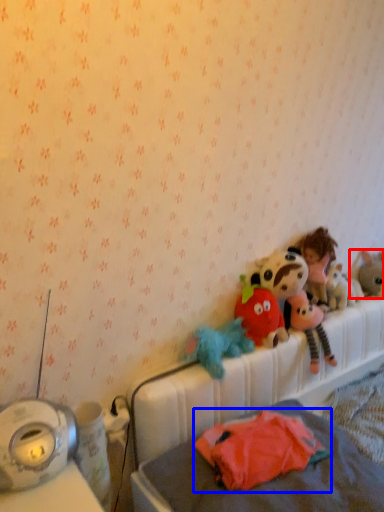
Question: Among these objects, which one is nearest to the camera, toy (highlighted by a red box) or toy (highlighted by a blue box)?

Choices:
 (A) toy
 (B) toy

Answer: (B)